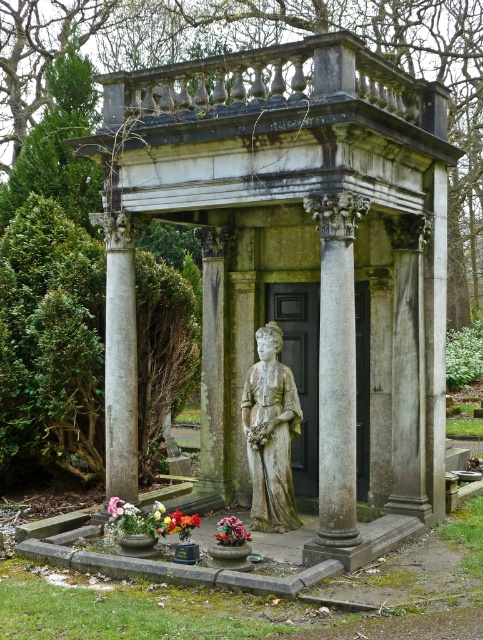
Question: Can you confirm if stone gazebo at center is positioned below gray stone column at center?

Choices:
 (A) yes
 (B) no

Answer: (B)

Question: Which object is closer to the camera taking this photo?

Choices:
 (A) gray stone column at center
 (B) stone statue at center
 (C) stone gazebo at center
 (D) white fabric flower at center

Answer: (C)

Question: Is stone statue at center positioned behind white fabric flower at center?

Choices:
 (A) no
 (B) yes

Answer: (B)

Question: Which object appears closest to the camera in this image?

Choices:
 (A) gray stone column at center
 (B) stone gazebo at center

Answer: (B)

Question: Which of the following is the farthest from the observer?

Choices:
 (A) matte ceramic vase at center
 (B) vivid red petals at center

Answer: (B)

Question: Can you confirm if gray stone column at center is wider than white fabric flower at center?

Choices:
 (A) yes
 (B) no

Answer: (A)